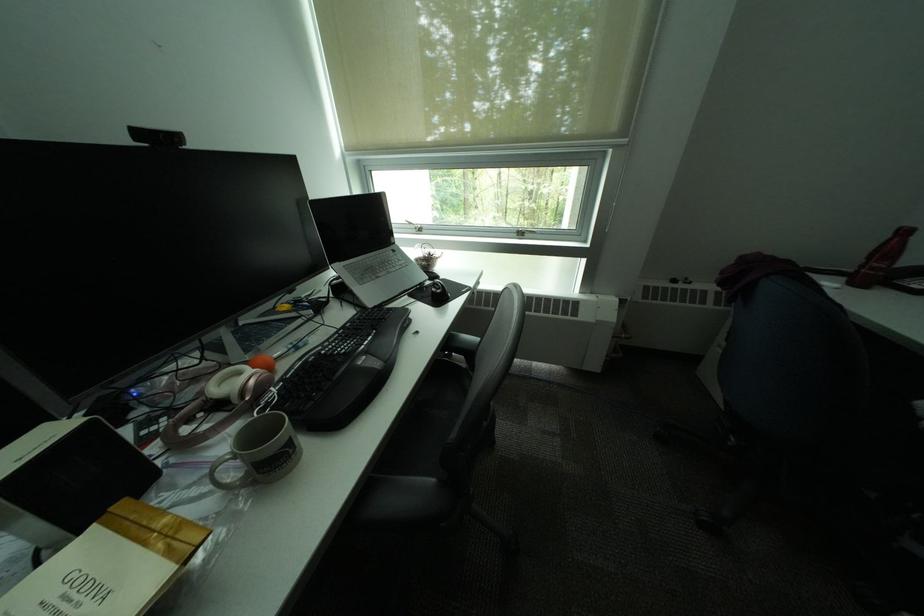
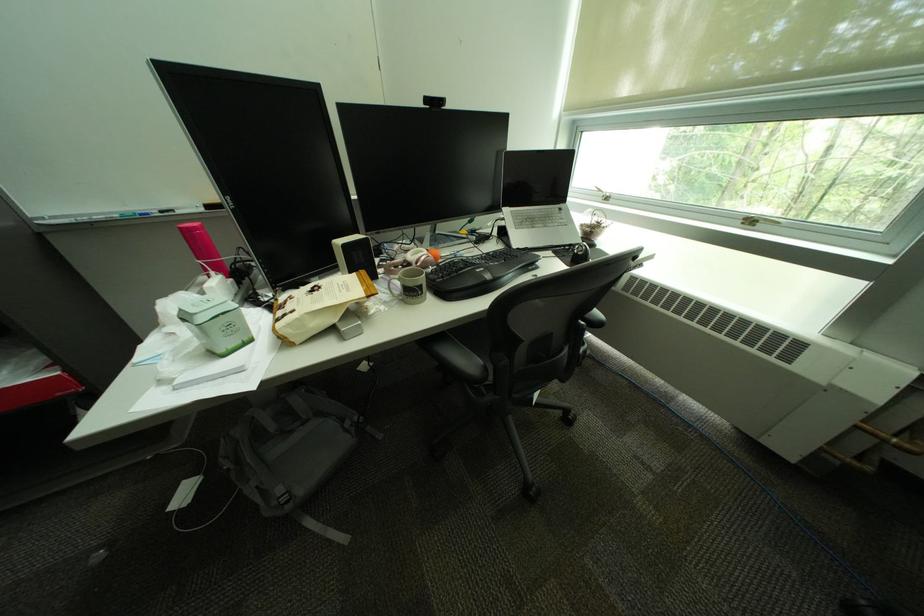
In the second image, find the point that corresponds to [531,235] in the first image.

(761, 224)